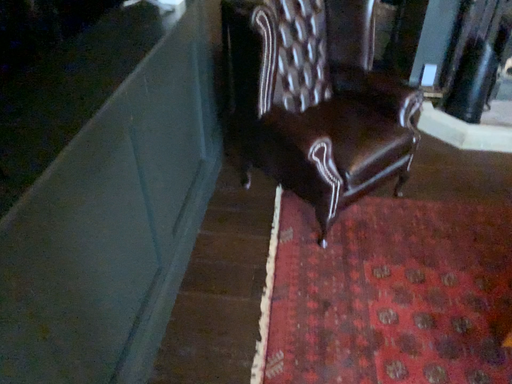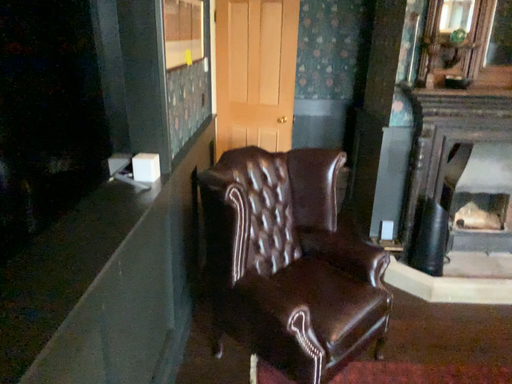
Question: Which way did the camera rotate in the video?

Choices:
 (A) rotated upward
 (B) rotated downward

Answer: (A)